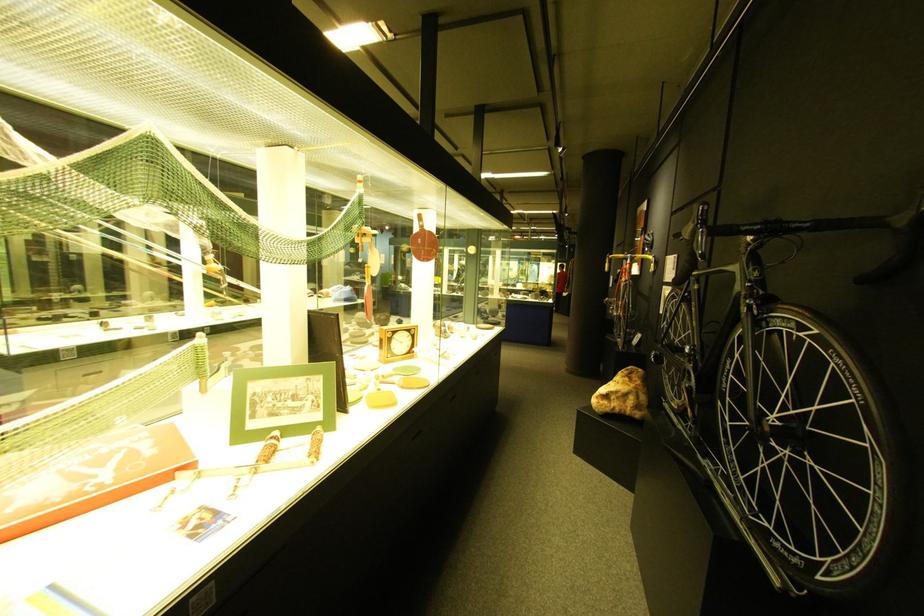
Find the location of a particular element. The height and width of the screenshot is (616, 924). large brown rock is located at coordinates pyautogui.click(x=623, y=394).